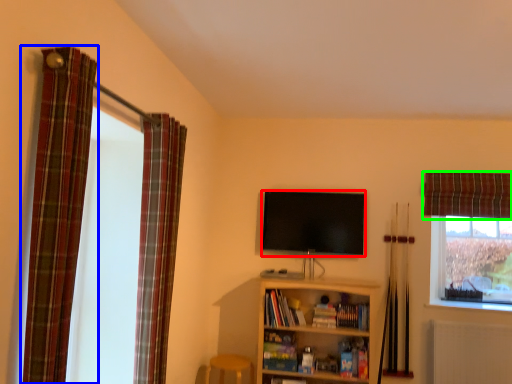
Question: Based on their relative distances, which object is farther from television (highlighted by a red box)? Choose from curtain (highlighted by a blue box) and curtain (highlighted by a green box).

Choices:
 (A) curtain
 (B) curtain

Answer: (A)